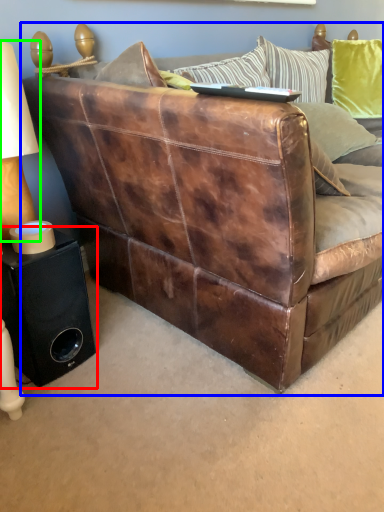
Question: Considering the real-world distances, which object is farthest from speaker (highlighted by a red box)? studio couch (highlighted by a blue box) or table lamp (highlighted by a green box)?

Choices:
 (A) studio couch
 (B) table lamp

Answer: (A)